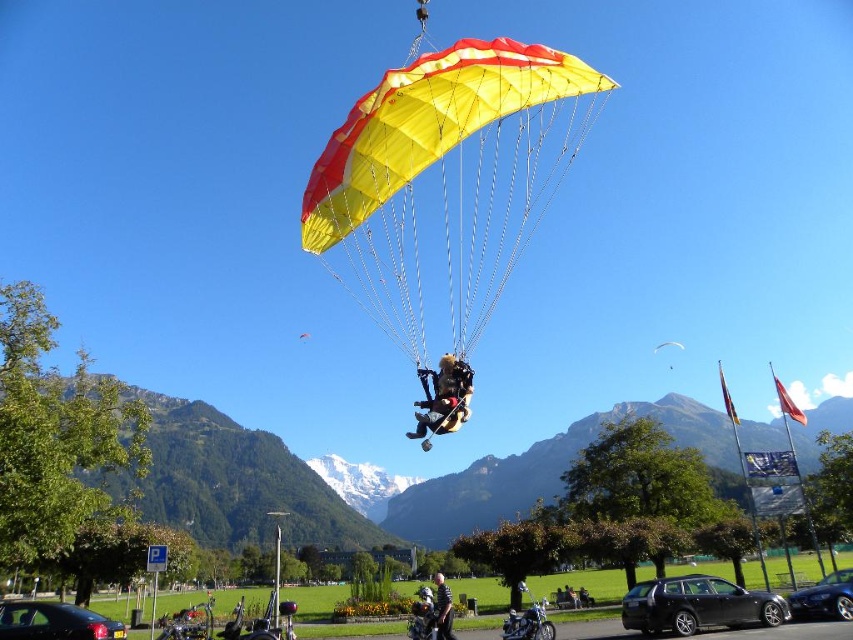
Question: Estimate the real-world distances between objects in this image. Which object is farther from the shiny blue car at lower right?

Choices:
 (A) shiny chrome motorcycle at lower center
 (B) dark gray leather jacket at lower center
 (C) black glossy car at lower left
 (D) yellow fabric parachute at upper center

Answer: (D)

Question: Is matte black parachute at center bigger than dark gray leather jacket at lower center?

Choices:
 (A) no
 (B) yes

Answer: (A)

Question: Can you confirm if black glossy car at lower left is smaller than yellow fabric parachute at upper center?

Choices:
 (A) no
 (B) yes

Answer: (A)

Question: Which of the following is the closest to the observer?

Choices:
 (A) matte black station wagon at lower right
 (B) shiny chrome motorcycle at lower center
 (C) black glossy car at lower left
 (D) yellow fabric parachute at center

Answer: (D)

Question: Based on their relative distances, which object is nearer to the black glossy car at lower left?

Choices:
 (A) shiny chrome motorcycle at lower center
 (B) yellow fabric parachute at upper center
 (C) shiny chrome motorcycle at center
 (D) dark gray leather jacket at lower center

Answer: (C)

Question: Is matte black parachute at center to the left of yellow fabric parachute at upper center from the viewer's perspective?

Choices:
 (A) no
 (B) yes

Answer: (B)